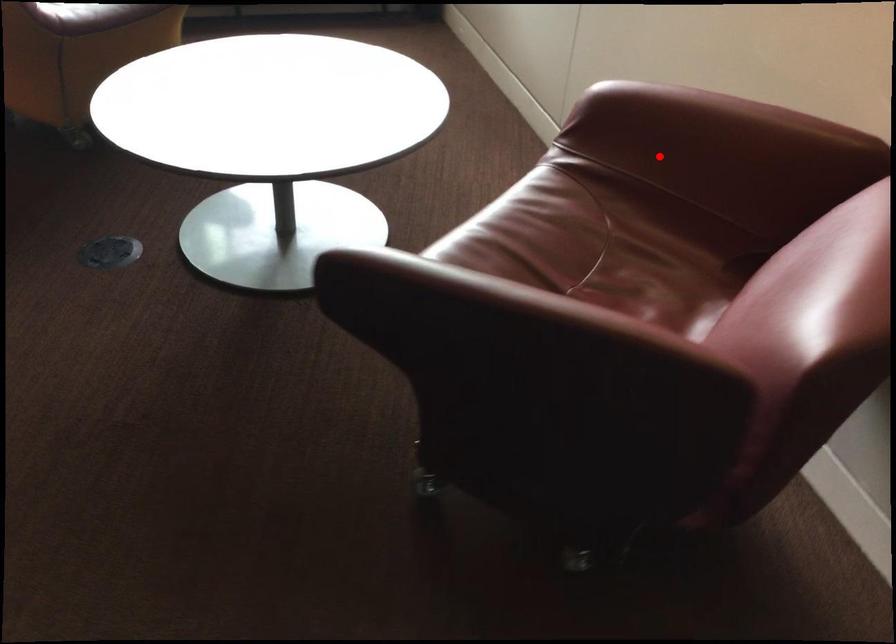
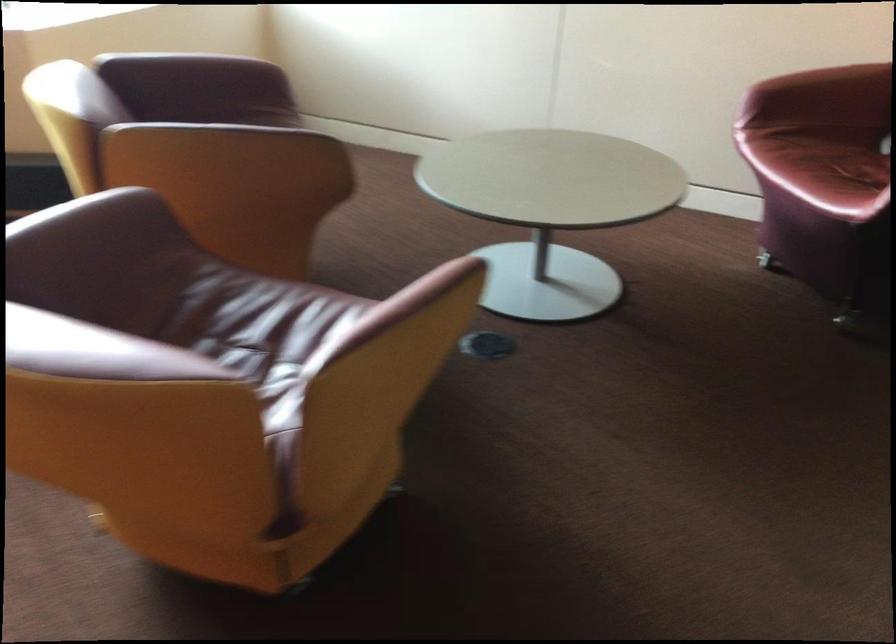
Where in the second image is the point corresponding to the highlighted location from the first image?

(822, 95)